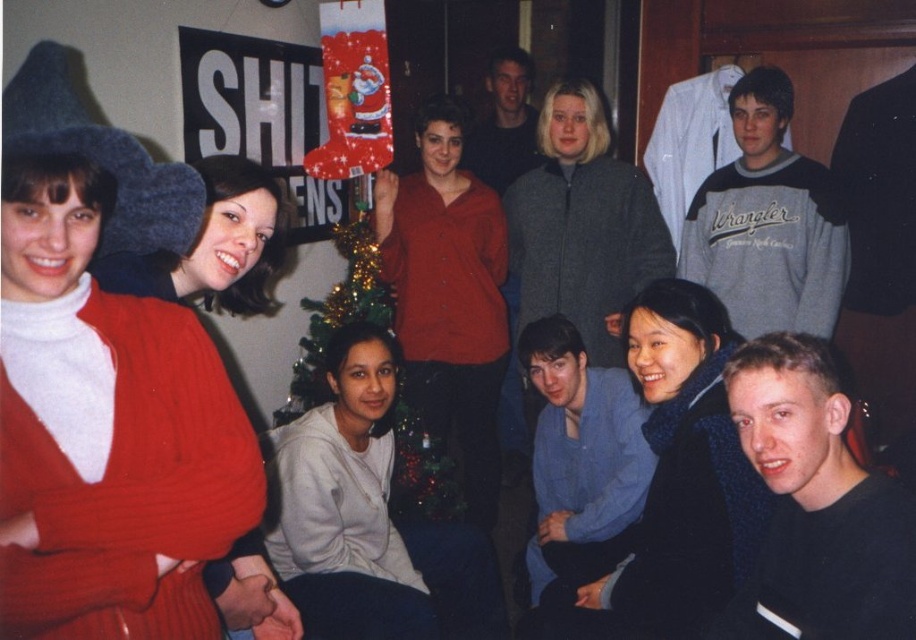
Question: Is black matte shirt at lower right to the left of blue cotton shirt at center from the viewer's perspective?

Choices:
 (A) no
 (B) yes

Answer: (A)

Question: Is black matte shirt at lower right further to the viewer compared to smooth gray sweater at upper center?

Choices:
 (A) no
 (B) yes

Answer: (A)

Question: Which of the following is the closest to the observer?

Choices:
 (A) (601, 515)
 (B) (911, 570)
 (C) (829, 205)

Answer: (B)

Question: Estimate the real-world distances between objects in this image. Which object is closer to the blue cotton shirt at center?

Choices:
 (A) gray/black sweatshirt at upper right
 (B) smooth gray sweater at upper center

Answer: (A)

Question: Which object is the closest to the black matte shirt at lower right?

Choices:
 (A) gray/black sweatshirt at upper right
 (B) smooth gray sweater at upper center
 (C) blue cotton shirt at center

Answer: (C)

Question: Is blue cotton shirt at center positioned before smooth gray sweater at upper center?

Choices:
 (A) yes
 (B) no

Answer: (A)